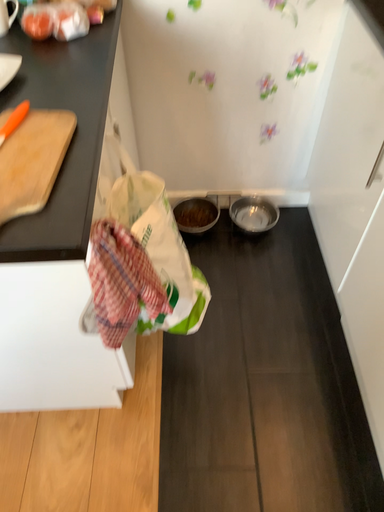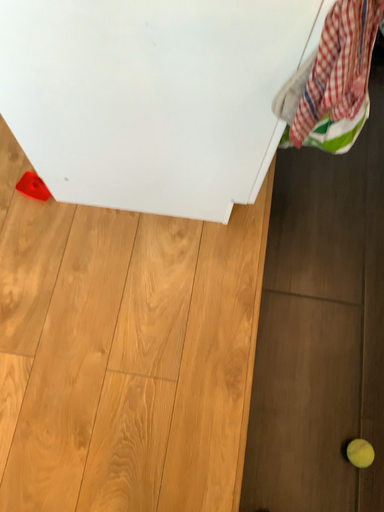
Question: How did the camera likely rotate when shooting the video?

Choices:
 (A) rotated downward
 (B) rotated upward

Answer: (A)